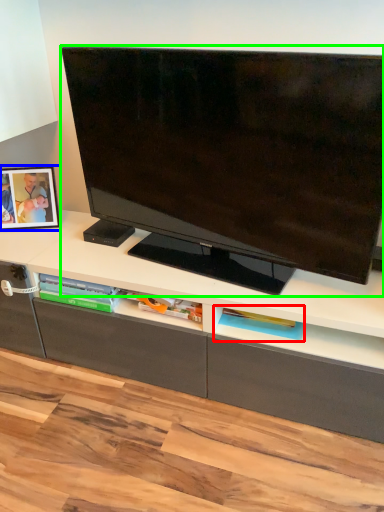
Question: Which object is the farthest from shelf (highlighted by a red box)? Choose among these: picture frame (highlighted by a blue box) or television (highlighted by a green box).

Choices:
 (A) picture frame
 (B) television

Answer: (A)